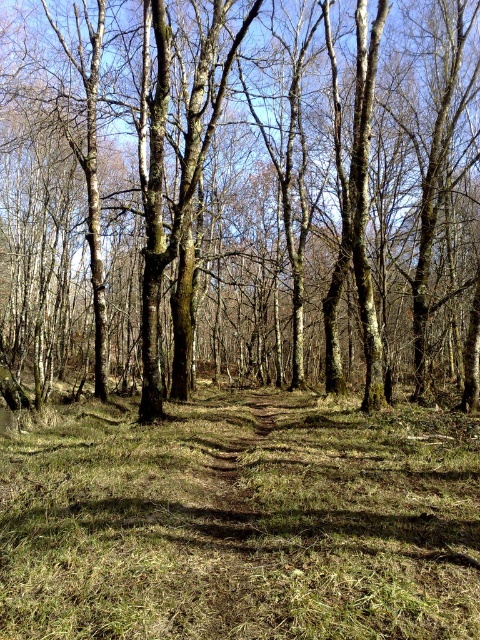
Question: Can you confirm if brown bark tree at center is bigger than green grass at center?

Choices:
 (A) yes
 (B) no

Answer: (A)

Question: Which point appears closest to the camera in this image?

Choices:
 (A) (462, 620)
 (B) (232, 264)

Answer: (A)

Question: Is brown bark tree at center above green grass at center?

Choices:
 (A) yes
 (B) no

Answer: (A)

Question: Can you confirm if brown bark tree at center is positioned to the right of green grass at center?

Choices:
 (A) no
 (B) yes

Answer: (A)

Question: Among these points, which one is nearest to the camera?

Choices:
 (A) (113, 499)
 (B) (456, 364)

Answer: (A)